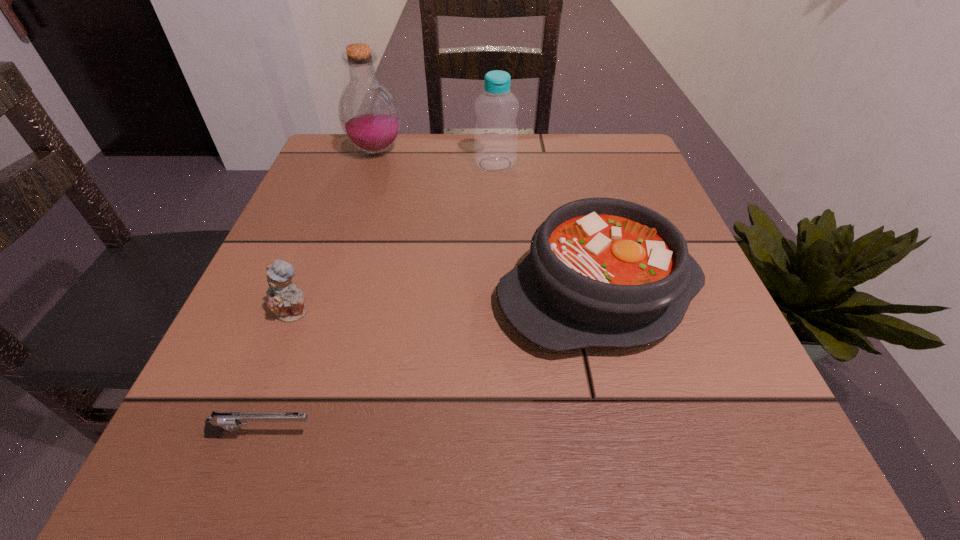
You are a GUI agent. You are given a task and a screenshot of the screen. Output one action in this format:
    pyautogui.click(x=<x>, y=<y>)
    Task: Click on the left bottle
    
    Given the screenshot: What is the action you would take?
    pyautogui.click(x=369, y=115)

You are a GUI agent. You are given a task and a screenshot of the screen. Output one action in this format:
    pyautogui.click(x=<x>, y=<y>)
    Task: Click on the right bottle
    This screenshot has height=540, width=960.
    Given the screenshot: What is the action you would take?
    pyautogui.click(x=495, y=136)

At what (x,y) coordinates should I click in order to perform the action: click on the shorter bottle. Please return your answer as a coordinate pair (x, y). Looking at the image, I should click on [495, 136].

You are a GUI agent. You are given a task and a screenshot of the screen. Output one action in this format:
    pyautogui.click(x=<x>, y=<y>)
    Task: Click on the casserole
    This screenshot has height=540, width=960.
    Given the screenshot: What is the action you would take?
    pyautogui.click(x=602, y=272)

Locate an element on the screen. the fourth tallest object is located at coordinates (286, 300).

Where is `pistol`? This screenshot has height=540, width=960. pistol is located at coordinates (219, 421).

What are the coordinates of `the shortest object` in the screenshot? It's located at (219, 421).

This screenshot has height=540, width=960. In order to click on vacant space situated 0.140m on the front of the left bottle in this screenshot , I will do `click(359, 202)`.

What are the coordinates of `vacant area located on the right of the right bottle` in the screenshot? It's located at (539, 164).

Find the location of a particular element. The width and height of the screenshot is (960, 540). vacant region located on the front of the casserole is located at coordinates (627, 401).